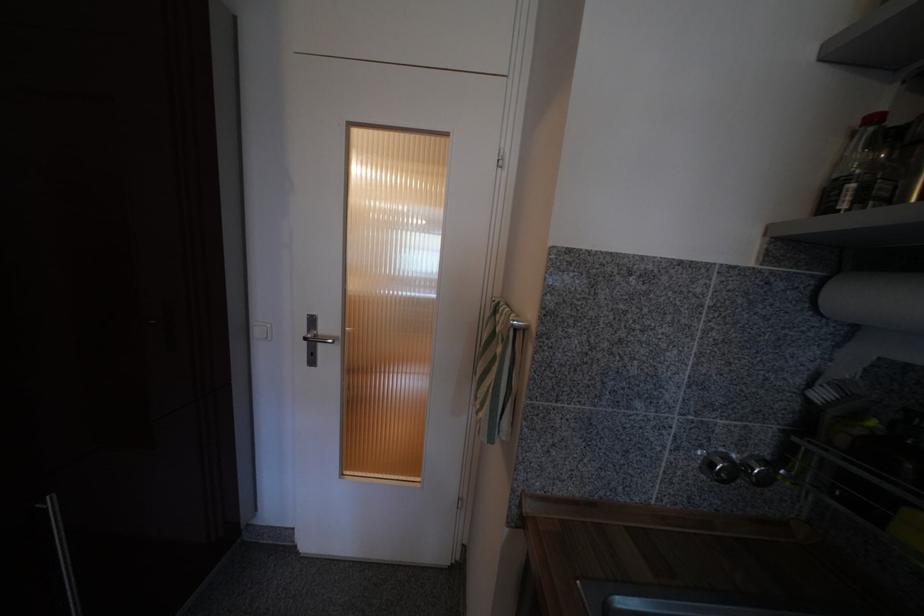
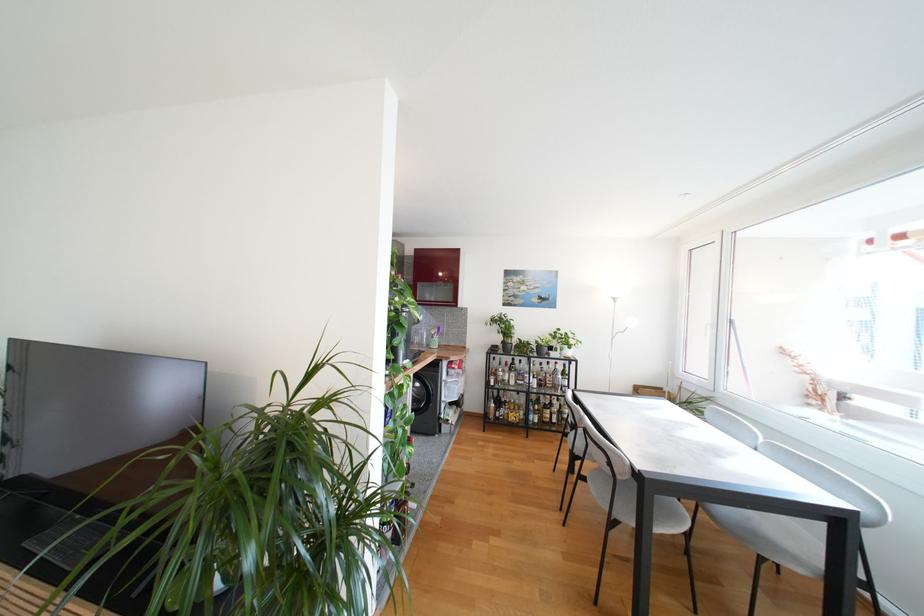
Question: I am providing you with two images of the same scene from different viewpoints. After the viewpoint changes to image2, which objects are now occluded?

Choices:
 (A) white window handle
 (B) glass bottle
 (C) white spiral vase
 (D) silver faucet knob

Answer: (D)